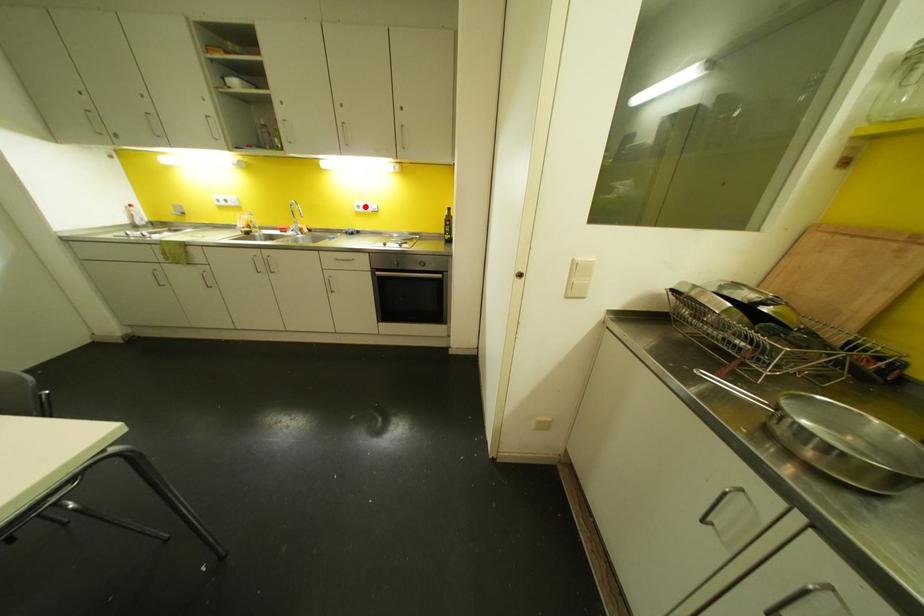
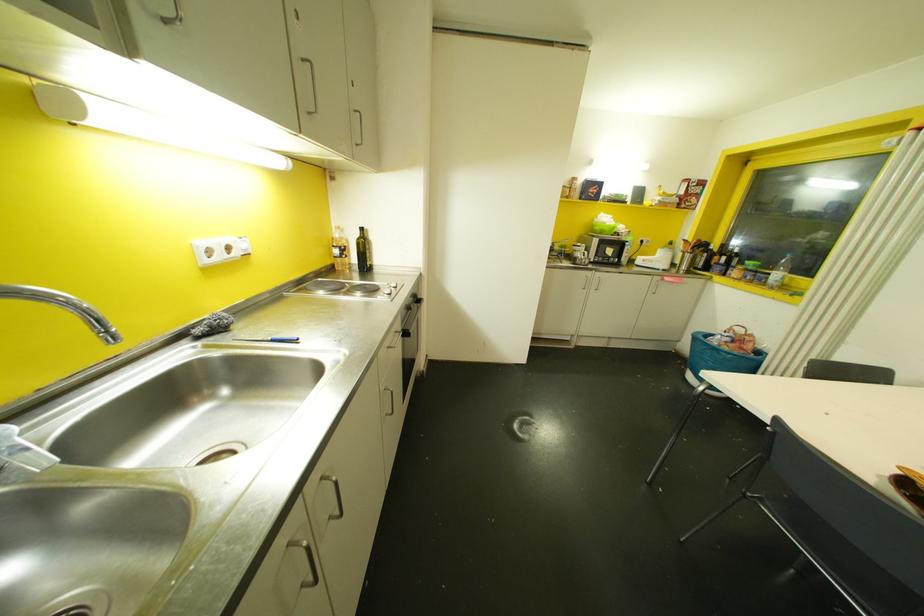
Question: I am providing you with two images of the same scene from different viewpoints. Image1 has a red point marked. In image2, the corresponding 3D location appears at what relative position? Reply with the corresponding letter.

Choices:
 (A) Closer
 (B) Farther

Answer: (B)